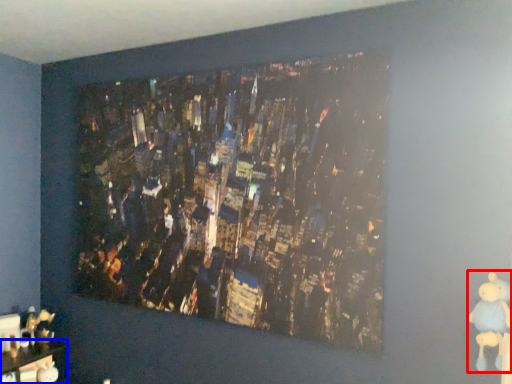
Question: Which of the following is the closest to the observer, toy (highlighted by a red box) or furniture (highlighted by a blue box)?

Choices:
 (A) toy
 (B) furniture

Answer: (A)